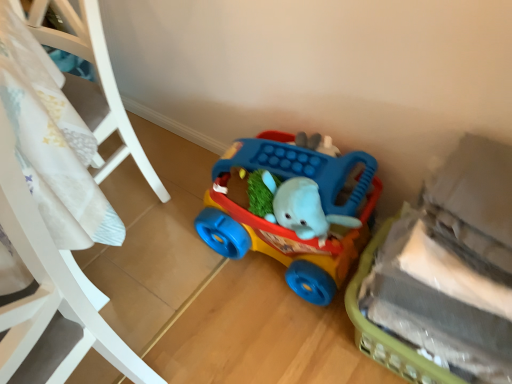
Question: Could plush gray elephant at lower right, arranged as the second toy when viewed from the back, be considered to be inside white plastic crib at left?

Choices:
 (A) no
 (B) yes

Answer: (A)

Question: Can you confirm if white plastic crib at left is smaller than plush gray elephant at lower right, marked as the first toy in a front-to-back arrangement?

Choices:
 (A) yes
 (B) no

Answer: (B)

Question: Would you consider white plastic crib at left to be distant from plush gray elephant at lower right, arranged as the second toy when viewed from the back?

Choices:
 (A) no
 (B) yes

Answer: (A)

Question: From a real-world perspective, is white plastic crib at left located higher than plush gray elephant at lower right, arranged as the second toy when viewed from the back?

Choices:
 (A) no
 (B) yes

Answer: (B)

Question: Does white plastic crib at left have a greater width compared to plush gray elephant at lower right, arranged as the second toy when viewed from the back?

Choices:
 (A) yes
 (B) no

Answer: (A)

Question: Considering the positions of point (19, 44) and point (437, 213), is point (19, 44) closer or farther from the camera than point (437, 213)?

Choices:
 (A) closer
 (B) farther

Answer: (B)

Question: Considering the positions of white plastic crib at left and plush gray elephant at lower right, arranged as the second toy when viewed from the back, in the image, is white plastic crib at left taller or shorter than plush gray elephant at lower right, arranged as the second toy when viewed from the back,?

Choices:
 (A) tall
 (B) short

Answer: (A)

Question: Choose the correct answer: Is white plastic crib at left inside plush gray elephant at lower right, marked as the first toy in a front-to-back arrangement, or outside it?

Choices:
 (A) inside
 (B) outside

Answer: (B)

Question: Looking at the image, does white plastic crib at left seem bigger or smaller compared to plush gray elephant at lower right, marked as the first toy in a front-to-back arrangement?

Choices:
 (A) big
 (B) small

Answer: (A)

Question: Based on their sizes in the image, would you say plush gray elephant at lower right, arranged as the second toy when viewed from the back, is bigger or smaller than white plastic crib at left?

Choices:
 (A) big
 (B) small

Answer: (B)

Question: Based on their positions, is plush gray elephant at lower right, marked as the first toy in a front-to-back arrangement, located to the left or right of white plastic crib at left?

Choices:
 (A) right
 (B) left

Answer: (A)

Question: Is plush gray elephant at lower right, marked as the first toy in a front-to-back arrangement, taller or shorter than white plastic crib at left?

Choices:
 (A) tall
 (B) short

Answer: (B)

Question: Is point (411, 372) positioned closer to the camera than point (95, 140)?

Choices:
 (A) farther
 (B) closer

Answer: (B)

Question: Is rubberized plastic walker at center, the first toy when ordered from back to front, taller or shorter than white plastic crib at left?

Choices:
 (A) short
 (B) tall

Answer: (A)

Question: Considering the positions of rubberized plastic walker at center, which is the 2th toy in front-to-back order, and white plastic crib at left in the image, is rubberized plastic walker at center, which is the 2th toy in front-to-back order, wider or thinner than white plastic crib at left?

Choices:
 (A) thin
 (B) wide

Answer: (A)